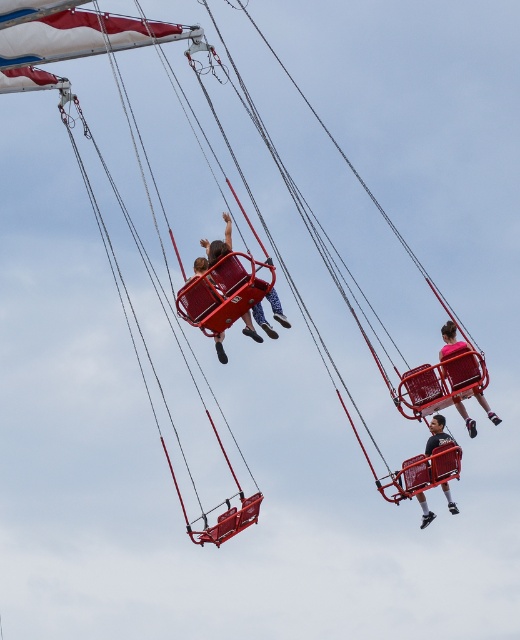
In the scene shown: Can you confirm if matte red swing at center is positioned to the right of matte black helmet at center?

No, matte red swing at center is not to the right of matte black helmet at center.

Between matte red swing at center and matte black helmet at center, which one has less height?

matte black helmet at center is shorter.

Is point (275, 300) closer to camera compared to point (438, 444)?

Yes, point (275, 300) is closer to viewer.

Identify the location of matte red swing at center. [x=218, y=243].

Who is more forward, [448,348] or [425,522]?

Point [448,348]

In the scene shown: Can you confirm if matte red swing at right is positioned to the right of matte black helmet at center?

Indeed, matte red swing at right is positioned on the right side of matte black helmet at center.

Where is `matte red swing at right`? This screenshot has height=640, width=520. matte red swing at right is located at coordinates (450, 340).

Consider the image. Who is higher up, matte red swing at center or matte red swing at right?

matte red swing at center is higher up.

Between matte red swing at center and matte red swing at right, which one has more height?

matte red swing at center

Is point (221, 342) closer to camera compared to point (469, 422)?

Yes, it is.

This screenshot has height=640, width=520. I want to click on matte red swing at center, so click(x=218, y=243).